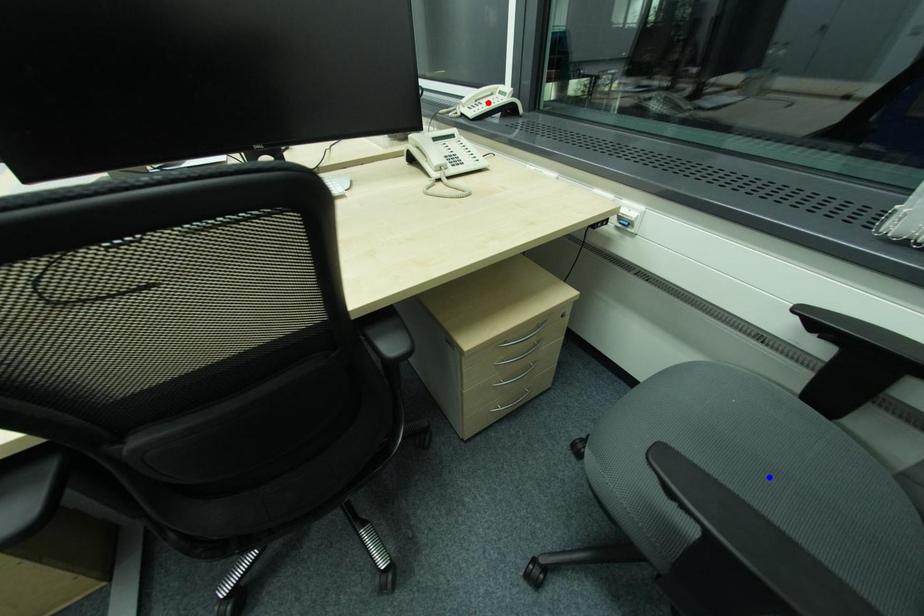
Question: Two points are marked on the image. Which point is closer to the camera?

Choices:
 (A) Blue point is closer.
 (B) Red point is closer.

Answer: (A)